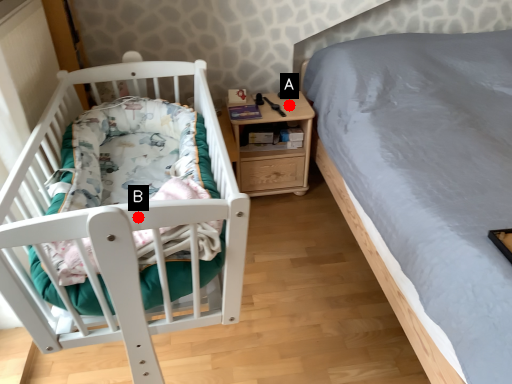
Question: Two points are circled on the image, labeled by A and B beside each circle. Which point is farther from the camera taking this photo?

Choices:
 (A) A is further
 (B) B is further

Answer: (A)